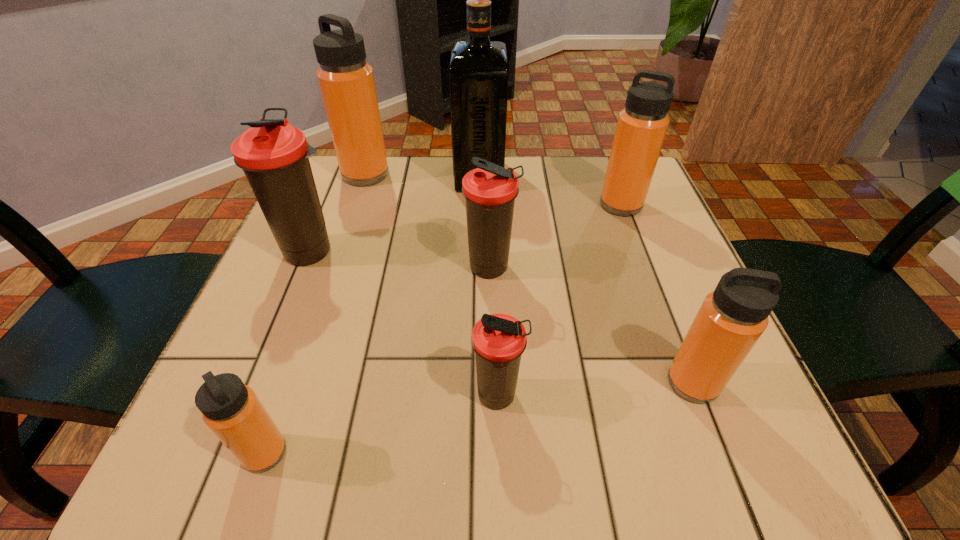
Identify the location of empty space between the biggest orange thermos bottle and the nearest object. (315, 314).

Locate an element on the screen. free space between the second smallest orange thermos bottle and the liquor is located at coordinates (586, 279).

Locate an element on the screen. The height and width of the screenshot is (540, 960). vacant space that's between the leftmost brown thermos bottle and the biggest orange thermos bottle is located at coordinates (339, 213).

I want to click on blank region between the second smallest orange thermos bottle and the nearest brown thermos bottle, so click(x=595, y=390).

Where is `unoccupied area between the second farthest thermos bottle and the second biggest brown thermos bottle`? This screenshot has width=960, height=540. unoccupied area between the second farthest thermos bottle and the second biggest brown thermos bottle is located at coordinates (556, 237).

At what (x,y) coordinates should I click in order to perform the action: click on vacant space that's between the leftmost brown thermos bottle and the second smallest brown thermos bottle. Please return your answer as a coordinate pair (x, y). The height and width of the screenshot is (540, 960). Looking at the image, I should click on tap(401, 260).

Find the location of a particular element. The height and width of the screenshot is (540, 960). free space between the second farthest orange thermos bottle and the nearest orange thermos bottle is located at coordinates (443, 329).

Locate an element on the screen. free space between the liquor and the second farthest thermos bottle is located at coordinates (550, 190).

In order to click on empty location between the second smallest orange thermos bottle and the farthest orange thermos bottle in this screenshot , I will do `click(529, 279)`.

Image resolution: width=960 pixels, height=540 pixels. I want to click on object that is the closest to the third smallest orange thermos bottle, so click(478, 76).